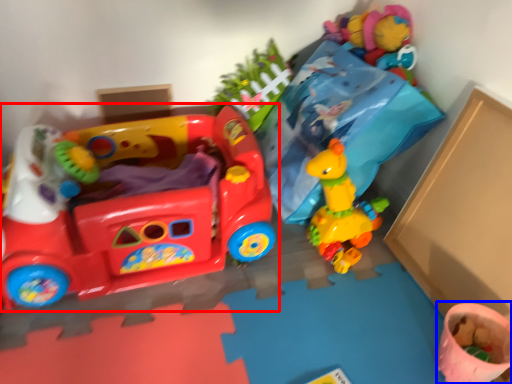
Question: Which of the following is the closest to the observer, toy (highlighted by a red box) or toy (highlighted by a blue box)?

Choices:
 (A) toy
 (B) toy

Answer: (A)